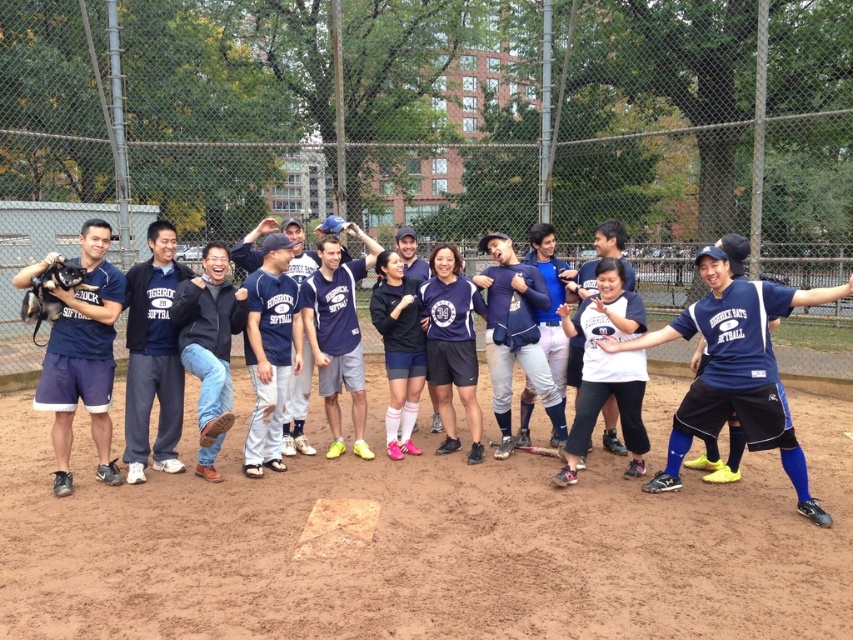
Between black matte jacket at center and dark brown leather glove at left, which one appears on the left side from the viewer's perspective?

dark brown leather glove at left is more to the left.

Measure the distance between black matte jacket at center and camera.

They are 5.60 meters apart.

The image size is (853, 640). Identify the location of black matte jacket at center. (209, 348).

Looking at this image, between matte blue shorts at left and dark brown leather glove at left, which one appears on the right side from the viewer's perspective?

Positioned to the right is matte blue shorts at left.

Does point (91, 266) come closer to viewer compared to point (49, 266)?

No, it is not.

Find the location of a particular element. matte blue shorts at left is located at coordinates (83, 356).

Where is `matte blue shorts at left`? matte blue shorts at left is located at coordinates (83, 356).

Between dark blue sweatshirt at center and navy blue jersey at center, which one appears on the left side from the viewer's perspective?

dark blue sweatshirt at center is more to the left.

Which is above, dark blue sweatshirt at center or navy blue jersey at center?

dark blue sweatshirt at center

Does point (142, 477) lie behind point (762, 445)?

Yes.

This screenshot has width=853, height=640. Identify the location of dark blue sweatshirt at center. click(x=154, y=356).